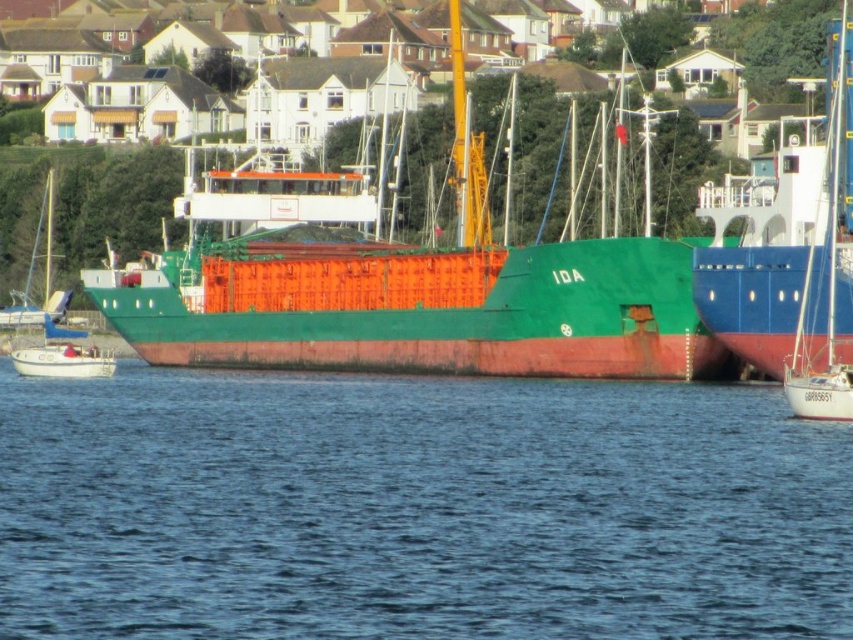
Question: Which of the following is the farthest from the observer?

Choices:
 (A) (844, 364)
 (B) (712, 452)

Answer: (A)

Question: Can you confirm if green matte cargo ship at center is wider than white sailboat at right?

Choices:
 (A) no
 (B) yes

Answer: (B)

Question: Does blue water at center appear over green matte cargo ship at center?

Choices:
 (A) no
 (B) yes

Answer: (A)

Question: Observing the image, what is the correct spatial positioning of blue water at center in reference to green matte cargo ship at center?

Choices:
 (A) above
 (B) below

Answer: (B)

Question: Which point is farther to the camera?

Choices:
 (A) (630, 630)
 (B) (836, 163)

Answer: (B)

Question: Which object is farther from the camera taking this photo?

Choices:
 (A) white sailboat at right
 (B) blue water at center

Answer: (A)